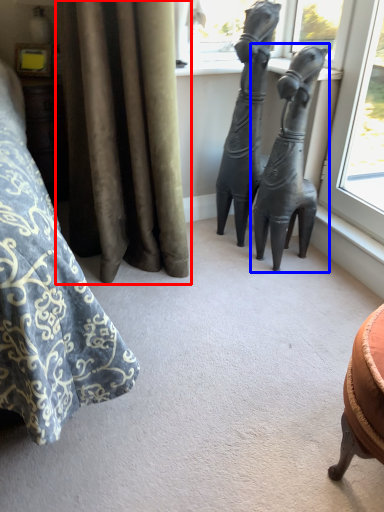
Question: Which of the following is the farthest to the observer, curtain (highlighted by a red box) or statue (sculpture) (highlighted by a blue box)?

Choices:
 (A) curtain
 (B) statue (sculpture)

Answer: (B)